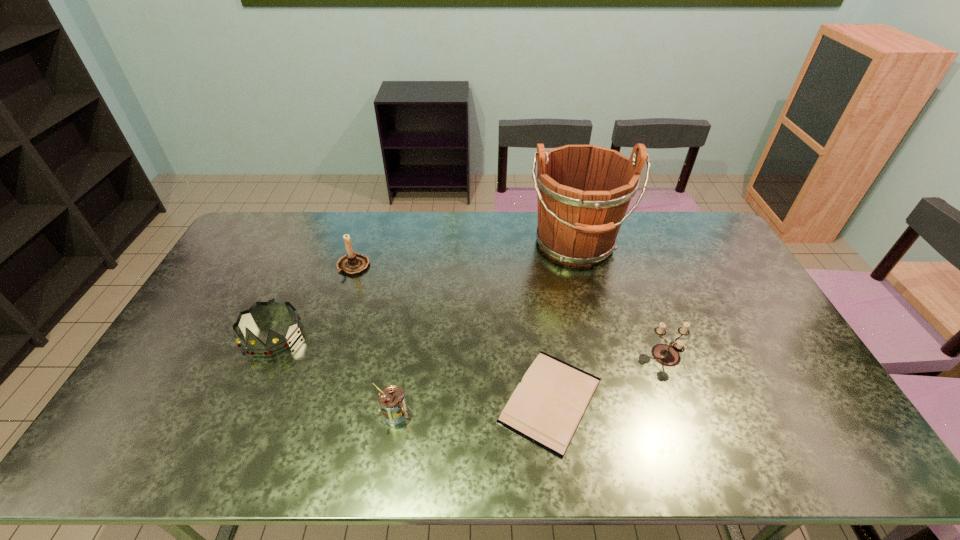
You are a GUI agent. You are given a task and a screenshot of the screen. Output one action in this format:
    pyautogui.click(x=<x>, y=<y>)
    Task: Click on the free region at the far left corner
    
    Given the screenshot: What is the action you would take?
    pyautogui.click(x=283, y=212)

In the image, there is a desktop. Where is `vacant space at the near left corner`? This screenshot has height=540, width=960. vacant space at the near left corner is located at coordinates (115, 433).

Identify the location of vacant space at the far right corner of the desktop. (684, 239).

Find the location of a particular element. Image resolution: width=960 pixels, height=540 pixels. vacant point located between the bucket and the fifth object from right to left is located at coordinates (465, 255).

Identify the location of free space between the second object from left to right and the tallest object. (465, 255).

In order to click on empty space that is in between the leftmost object and the tallest object in this screenshot , I will do `click(423, 290)`.

This screenshot has width=960, height=540. Find the location of `free space between the shortest object and the leftmost object`. free space between the shortest object and the leftmost object is located at coordinates (411, 367).

I want to click on free spot between the hardback book and the third object from left to right, so click(473, 407).

Locate an element on the screen. This screenshot has width=960, height=540. free space between the farther candle holder and the tiara is located at coordinates (312, 300).

The image size is (960, 540). In order to click on vacant region between the leftmost object and the can in this screenshot , I will do `click(333, 374)`.